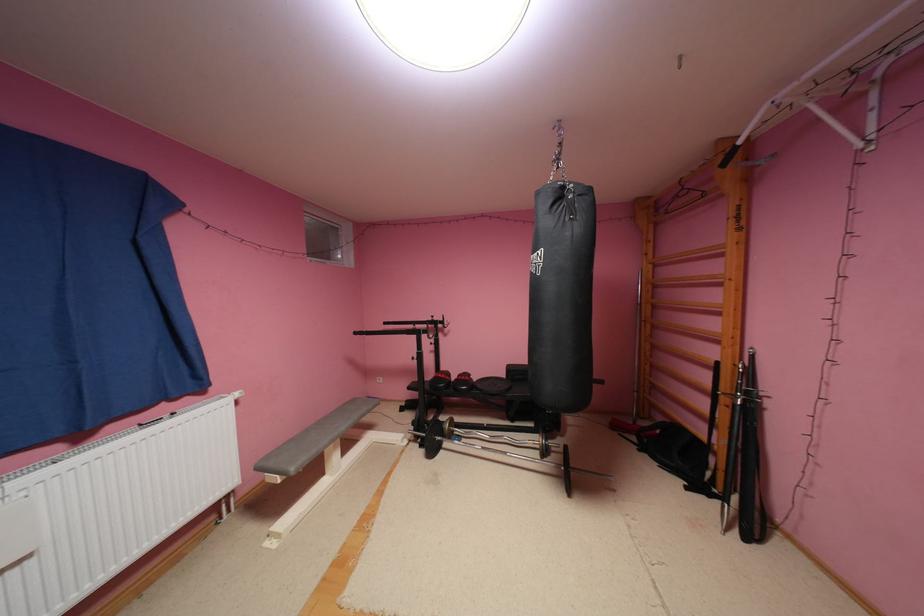
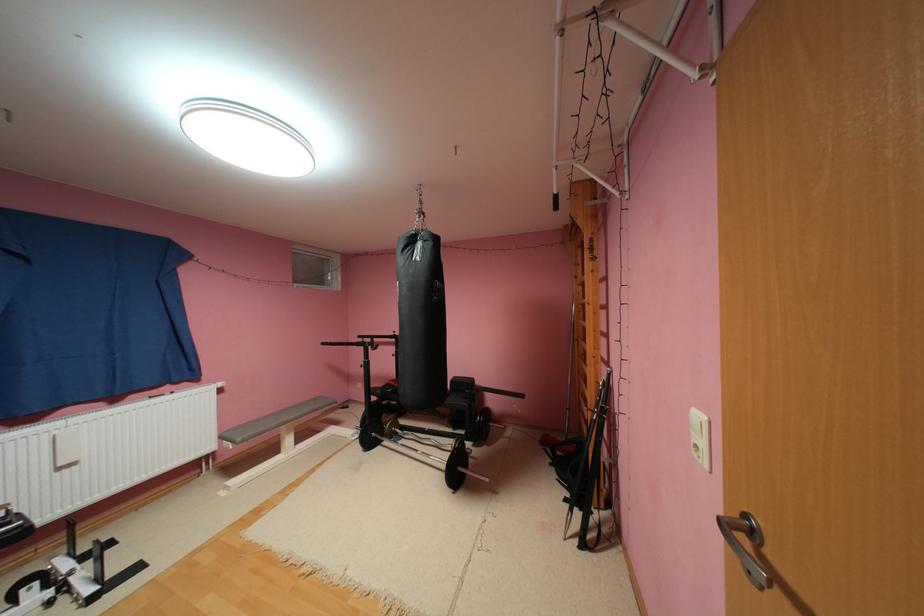
Find the pixel in the second image that matches [415,440] in the first image.

(366, 436)